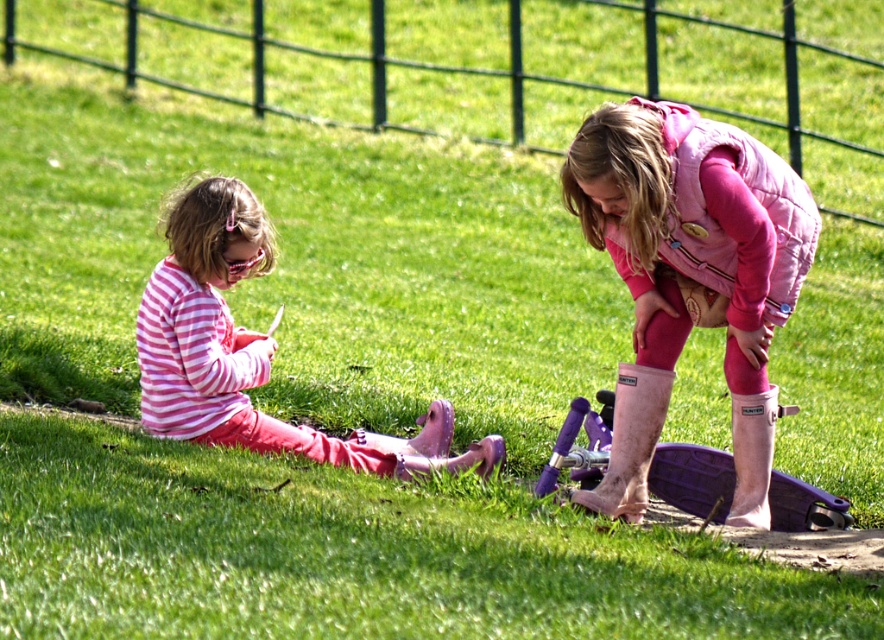
Question: Is pink rubber boots at lower right to the left of pink striped shirt at left from the viewer's perspective?

Choices:
 (A) no
 (B) yes

Answer: (A)

Question: Is pink rubber boots at lower right closer to the viewer compared to pink striped shirt at left?

Choices:
 (A) no
 (B) yes

Answer: (B)

Question: Which point is closer to the camera?

Choices:
 (A) (183, 292)
 (B) (680, 280)

Answer: (A)

Question: Which point is farther to the camera?

Choices:
 (A) (671, 147)
 (B) (161, 424)

Answer: (B)

Question: Can you confirm if pink rubber boots at lower right is positioned to the right of pink striped shirt at left?

Choices:
 (A) yes
 (B) no

Answer: (A)